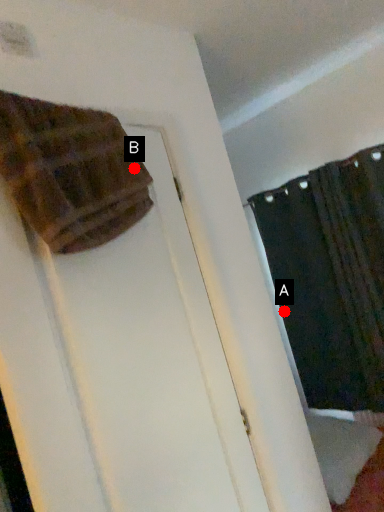
Question: Two points are circled on the image, labeled by A and B beside each circle. Which of the following is the closest to the observer?

Choices:
 (A) A is closer
 (B) B is closer

Answer: (B)